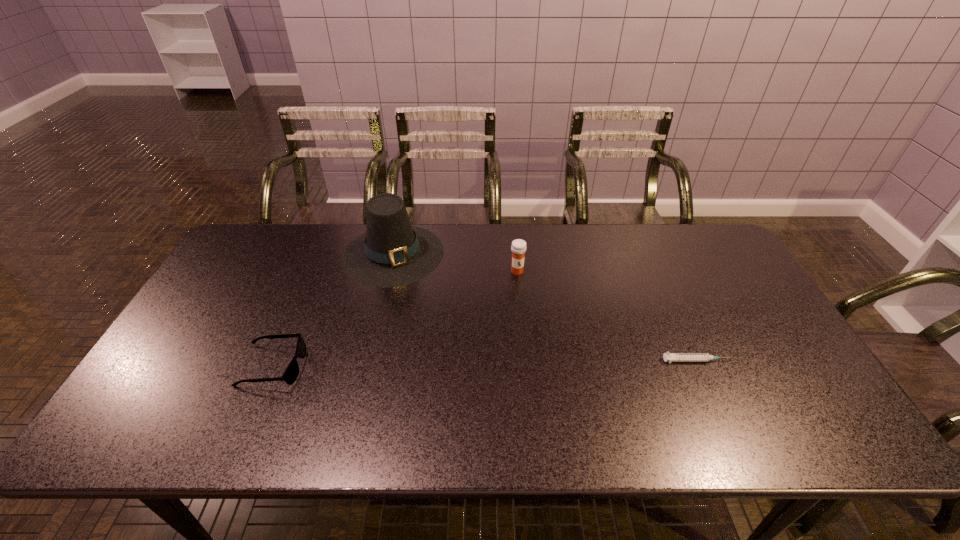
This screenshot has width=960, height=540. Find the location of `blank space at the right edge`. blank space at the right edge is located at coordinates (775, 330).

Locate an element on the screen. The height and width of the screenshot is (540, 960). vacant space at the near left corner is located at coordinates (152, 382).

In the image, there is a desktop. Find the location of `vacant space at the far right corner`. vacant space at the far right corner is located at coordinates (702, 254).

At what (x,y) coordinates should I click in order to perform the action: click on vacant space at the near right corner. Please return your answer as a coordinate pair (x, y). This screenshot has width=960, height=540. Looking at the image, I should click on (751, 389).

This screenshot has height=540, width=960. Identify the location of free space between the second tallest object and the syringe. (607, 316).

The image size is (960, 540). I want to click on free area in between the hat and the third shortest object, so click(455, 262).

Where is `vacant area between the tallest object and the sunglasses`? This screenshot has height=540, width=960. vacant area between the tallest object and the sunglasses is located at coordinates (333, 310).

Locate an element on the screen. This screenshot has width=960, height=540. vacant space that's between the tallest object and the sunglasses is located at coordinates (333, 310).

This screenshot has height=540, width=960. I want to click on empty space that is in between the medicine and the sunglasses, so click(x=395, y=319).

At what (x,y) coordinates should I click in order to perform the action: click on vacant area that lies between the sunglasses and the tallest object. Please return your answer as a coordinate pair (x, y). The height and width of the screenshot is (540, 960). Looking at the image, I should click on (333, 310).